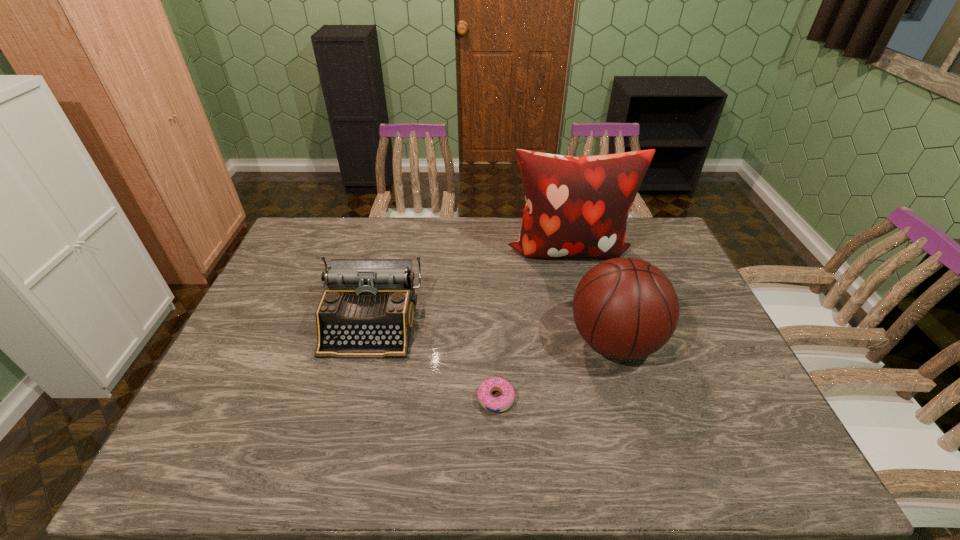
Where is `the tallest object`? Image resolution: width=960 pixels, height=540 pixels. the tallest object is located at coordinates (575, 206).

Locate an element on the screen. Image resolution: width=960 pixels, height=540 pixels. cushion is located at coordinates click(x=575, y=206).

What are the coordinates of `basketball` in the screenshot? It's located at (625, 308).

Find the location of a particular element. the third tallest object is located at coordinates (367, 311).

Where is `the leftmost object`? The width and height of the screenshot is (960, 540). the leftmost object is located at coordinates (367, 311).

I want to click on the nearest object, so click(x=493, y=404).

Where is `doughnut`? This screenshot has width=960, height=540. doughnut is located at coordinates (493, 404).

Find the location of a particular element. vacant region located 0.390m on the front-facing side of the farthest object is located at coordinates (598, 368).

You are a GUI agent. You are given a task and a screenshot of the screen. Output one action in this format:
    pyautogui.click(x=<x>, y=<y>)
    Task: Click on the free point located 0.170m on the left of the second tallest object
    The width and height of the screenshot is (960, 540).
    Given the screenshot: What is the action you would take?
    pyautogui.click(x=506, y=341)

Image resolution: width=960 pixels, height=540 pixels. Find the location of `free region located on the keyboard of the leftmost object`. free region located on the keyboard of the leftmost object is located at coordinates (347, 416).